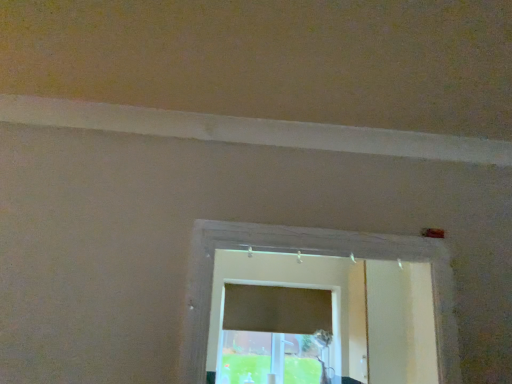
Find the location of a particular element. The width and height of the screenshot is (512, 384). brown fabric curtain at center is located at coordinates (276, 309).

In order to face brown fabric curtain at center, should I rotate leftwards or rightwards?

To face it directly, rotate right by 3.150 degrees.

Describe the element at coordinates (276, 309) in the screenshot. I see `brown fabric curtain at center` at that location.

What is the approximate height of brown fabric curtain at center?

brown fabric curtain at center is 17.57 inches in height.

The width and height of the screenshot is (512, 384). I want to click on brown fabric curtain at center, so point(276,309).